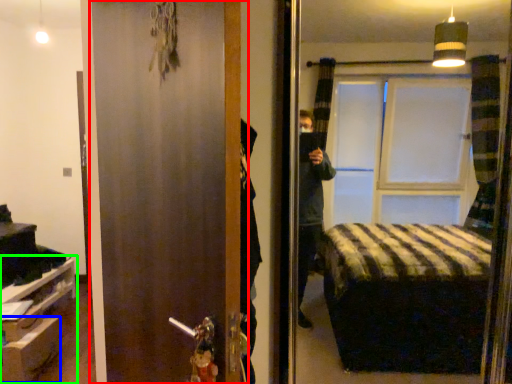
Question: Which is farther away from door (highlighted by a red box)? drawer (highlighted by a blue box) or furniture (highlighted by a green box)?

Choices:
 (A) drawer
 (B) furniture

Answer: (B)